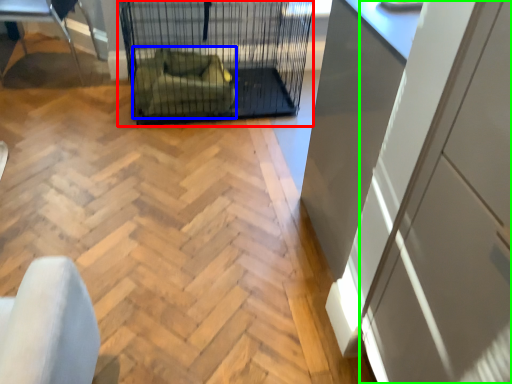
Question: Considering the real-world distances, which object is farthest from bird cage (highlighted by a red box)? armchair (highlighted by a blue box) or screen door (highlighted by a green box)?

Choices:
 (A) armchair
 (B) screen door

Answer: (B)